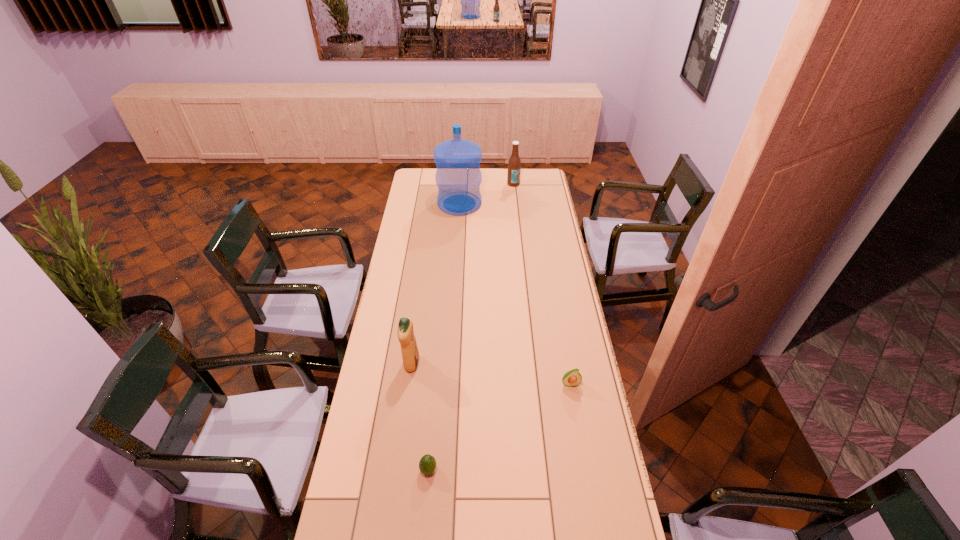
At what (x,y) coordinates should I click in order to perform the action: click on vacant space at the far right corner of the desktop. Please return your answer as a coordinate pair (x, y). This screenshot has width=960, height=540. Looking at the image, I should click on (543, 178).

Where is `blank region between the farthest object and the third nearest object`? blank region between the farthest object and the third nearest object is located at coordinates (463, 274).

Locate an element on the screen. This screenshot has width=960, height=540. vacant area that lies between the third nearest object and the farthest object is located at coordinates (463, 274).

Image resolution: width=960 pixels, height=540 pixels. I want to click on free spot between the nearer avocado and the detergent, so click(420, 416).

Identify the location of vacant area that lies between the detergent and the beer bottle. This screenshot has height=540, width=960. (463, 274).

Locate an element on the screen. The height and width of the screenshot is (540, 960). vacant region between the third farthest object and the second farthest object is located at coordinates click(x=436, y=284).

Identify the location of free space between the fourth nearest object and the third nearest object. (436, 284).

The height and width of the screenshot is (540, 960). Find the location of `blank region between the detergent and the shortest object`. blank region between the detergent and the shortest object is located at coordinates (x=420, y=416).

The height and width of the screenshot is (540, 960). What are the coordinates of `vacant space in between the fourth tallest object and the nearer avocado` in the screenshot? It's located at (499, 427).

Where is `object that stands as the fourth closest to the second object from right to left`? The height and width of the screenshot is (540, 960). object that stands as the fourth closest to the second object from right to left is located at coordinates (427, 464).